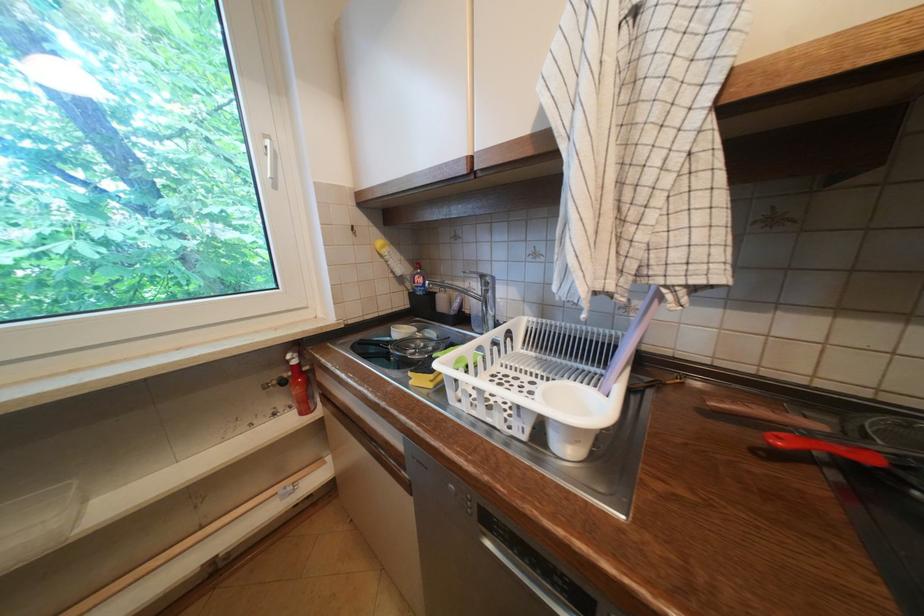
At what (x,y) coordinates should I click in order to perform the action: click on black pan handle. Please return your answer as a coordinate pair (x, y). Looking at the image, I should click on (845, 448).